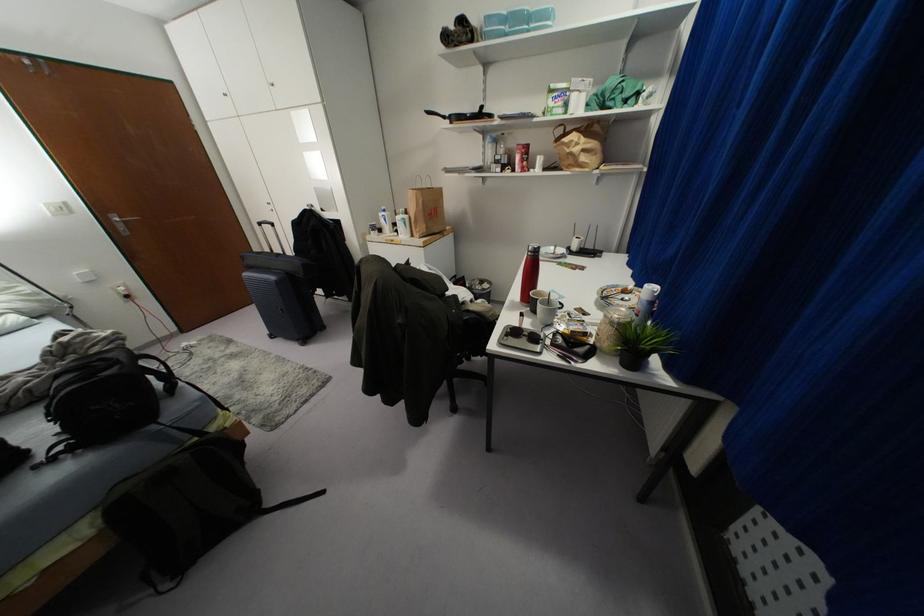
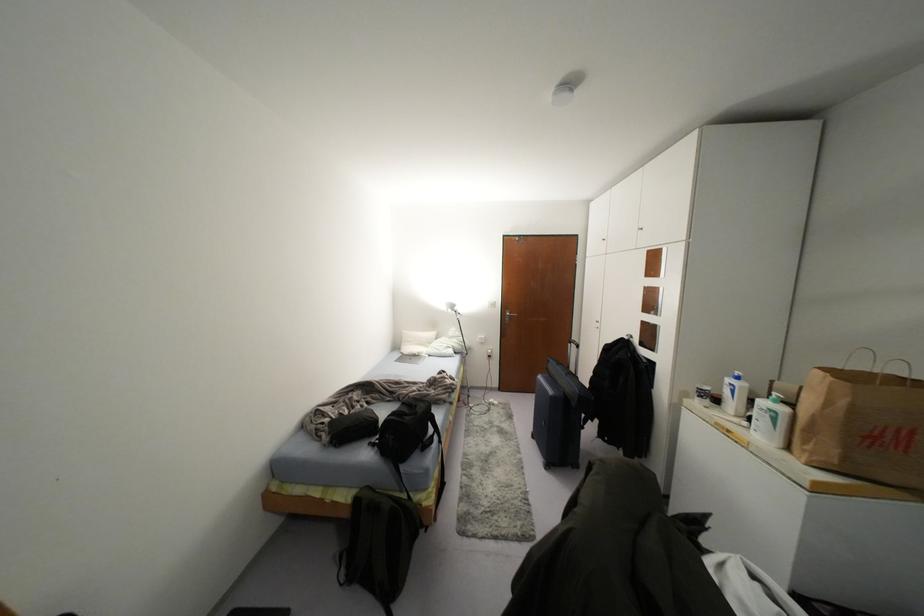
Question: How did the camera likely rotate?

Choices:
 (A) Left
 (B) Right
 (C) Up
 (D) Down

Answer: (A)